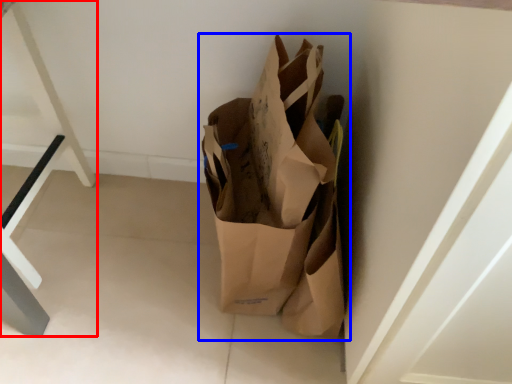
Question: Which of the following is the farthest to the observer, furniture (highlighted by a red box) or grocery bag (highlighted by a blue box)?

Choices:
 (A) furniture
 (B) grocery bag

Answer: (A)